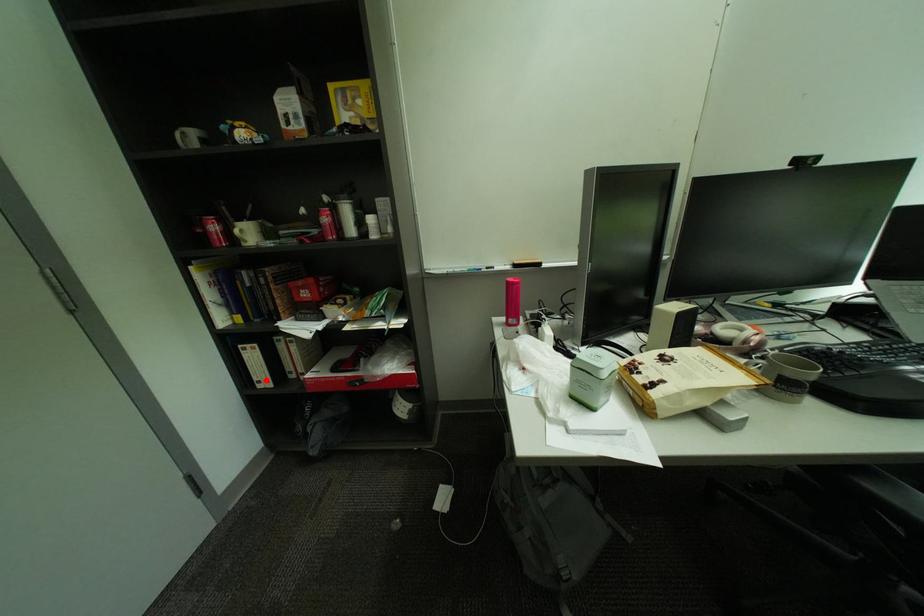
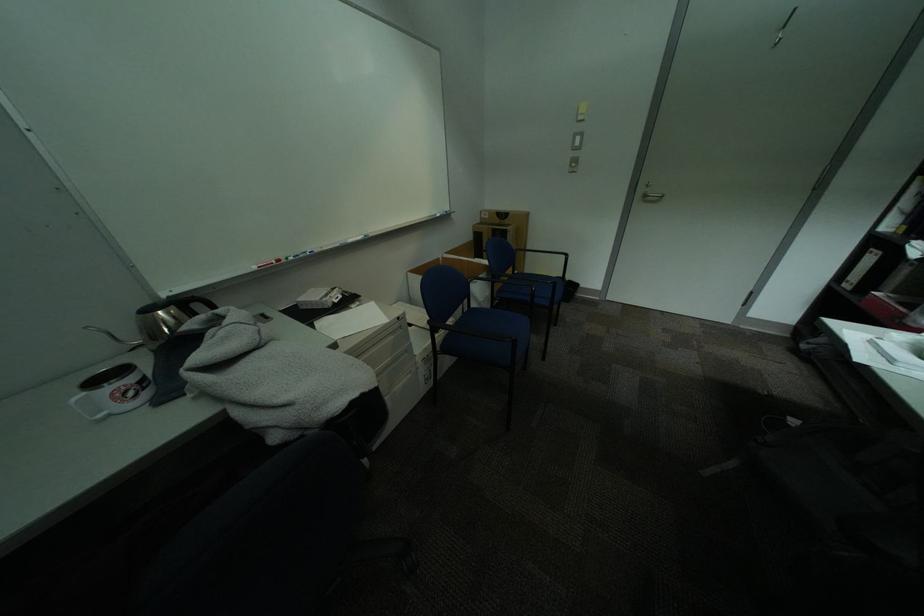
The point at the highlighted location is marked in the first image. Where is the corresponding point in the second image?

(859, 280)